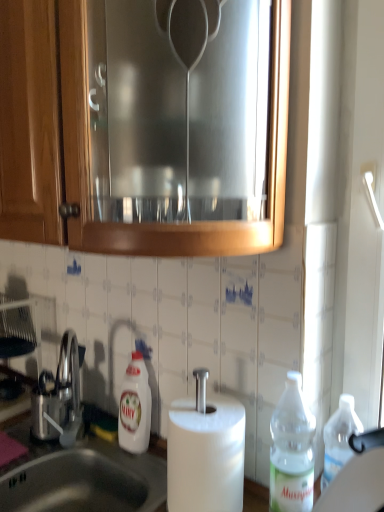
Question: From a real-world perspective, is satin silver sink at lower left above or below clear plastic bottle at right, which appears as the 1th bottle when viewed from the right?

Choices:
 (A) above
 (B) below

Answer: (B)

Question: Based on their sizes in the image, would you say satin silver sink at lower left is bigger or smaller than clear plastic bottle at right, which appears as the 1th bottle when viewed from the right?

Choices:
 (A) big
 (B) small

Answer: (A)

Question: Which of these objects is positioned closest to the satin silver sink at lower left?

Choices:
 (A) brushed metal cabinet at upper center
 (B) white glossy bottle at lower center, the 2th bottle when ordered from front to back
 (C) clear plastic bottle at right, the 2th bottle from the left
 (D) satin nickel faucet at lower left

Answer: (D)

Question: Estimate the real-world distances between objects in this image. Which object is closer to the satin silver sink at lower left?

Choices:
 (A) white glossy bottle at lower center, which is counted as the first bottle, starting from the back
 (B) brushed metal cabinet at upper center
 (C) satin nickel faucet at lower left
 (D) clear plastic bottle at right, arranged as the 1th bottle when viewed from the front

Answer: (C)